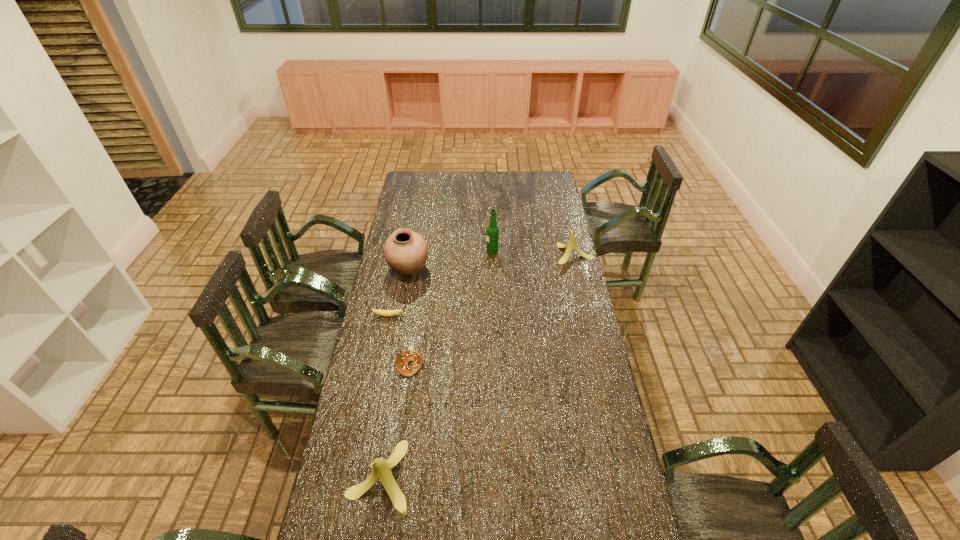
Where is `the fourth shortest object`? the fourth shortest object is located at coordinates (381, 470).

Where is `the tallest banana`? the tallest banana is located at coordinates (381, 470).

You are a GUI agent. You are given a task and a screenshot of the screen. Output one action in this format:
    pyautogui.click(x=<x>, y=<y>)
    Task: Click on the rightmost object
    The image size is (960, 540).
    Given the screenshot: What is the action you would take?
    pyautogui.click(x=572, y=243)

Find the location of `the rightmost banana`. the rightmost banana is located at coordinates (572, 243).

This screenshot has height=540, width=960. I want to click on beer bottle, so click(492, 230).

Where is `the shortest banana`? the shortest banana is located at coordinates (386, 313).

Locate an element on the screen. The image size is (960, 540). the fourth farthest object is located at coordinates (386, 313).

Locate an element on the screen. The width and height of the screenshot is (960, 540). pottery is located at coordinates (405, 251).

Identify the location of the fifth farthest object. (404, 358).

Locate an element on the screen. The width and height of the screenshot is (960, 540). the shortest object is located at coordinates (404, 358).